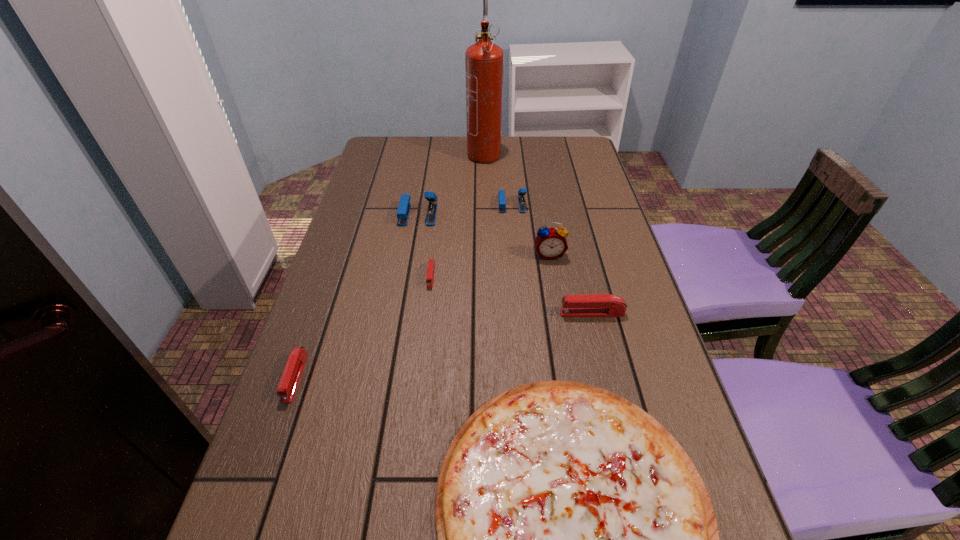
Identify the location of stapler that can be found as the fifth closest to the red alarm clock. (294, 367).

Where is `red stapler that can be found as the second closest to the leftmost red stapler`? The height and width of the screenshot is (540, 960). red stapler that can be found as the second closest to the leftmost red stapler is located at coordinates (592, 305).

Locate which red stapler is the second closest to the red alarm clock. Please provide its 2D coordinates. Your answer should be formatted as a tuple, i.e. [(x, y)], where the tuple contains the x and y coordinates of a point satisfying the conditions above.

[(431, 263)]

The image size is (960, 540). I want to click on free region that satisfies the following two spatial constraints: 1. on the front-facing side of the rightmost stapler; 2. on the front-facing side of the leftmost stapler, so click(x=608, y=377).

At what (x,y) coordinates should I click in order to perform the action: click on blank space that satisfies the following two spatial constraints: 1. from the nozzle of the fire extinguisher; 2. on the left side of the second tallest stapler. Please return your answer as a coordinate pair (x, y). Looking at the image, I should click on (485, 205).

Locate an element on the screen. This screenshot has width=960, height=540. vacant area in the image that satisfies the following two spatial constraints: 1. on the back side of the second tallest stapler; 2. on the right side of the third tallest object is located at coordinates (420, 205).